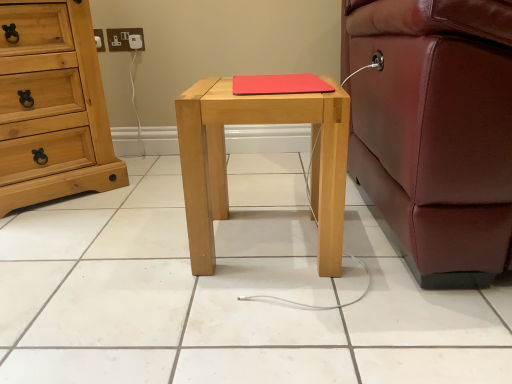
I want to click on vacant space that is to the left of light wood/texture nightstand at center, so click(137, 250).